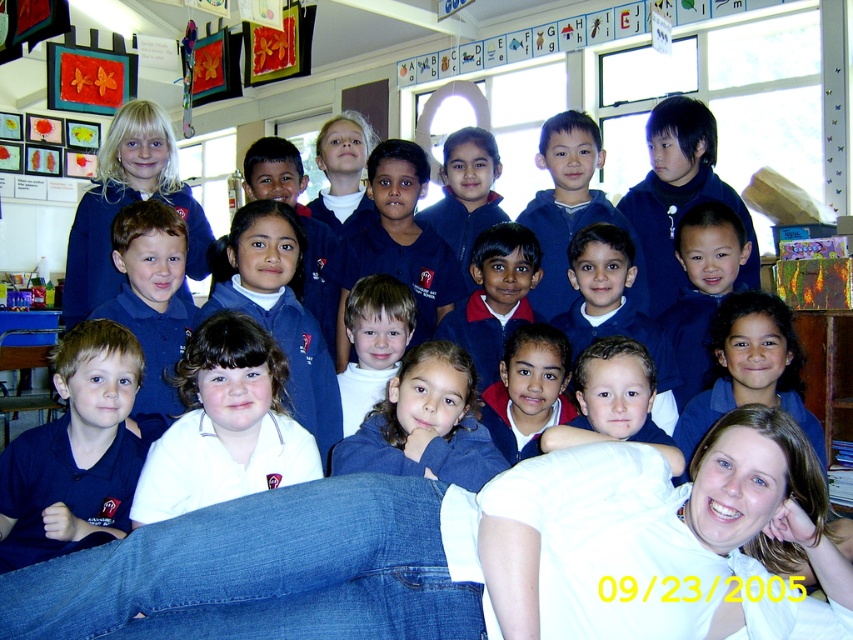
You are a student in the classroom and want to sit between the matte blue shirt at lower left and the white turtleneck sweater at center. Can you fit comfortably between them if you need at least 50 cm of space?

The matte blue shirt at lower left is wider than the white turtleneck sweater at center. However, the exact width difference isn

In the classroom scene, there are two people wearing the matte blue shirt at lower left and the white turtleneck sweater at center. Which of these two is positioned more to the left side of the image?

The matte blue shirt at lower left is positioned more to the left side of the image compared to the white turtleneck sweater at center.

You are a photographer standing at the camera position. You want to take a closeup shot of the matte blue uniform at upper left. Can you estimate how far you need to move forward to focus on it?

The matte blue uniform at upper left is 2.69 meters away from camera, so you need to move forward to 2.69 meters distance to focus on it.